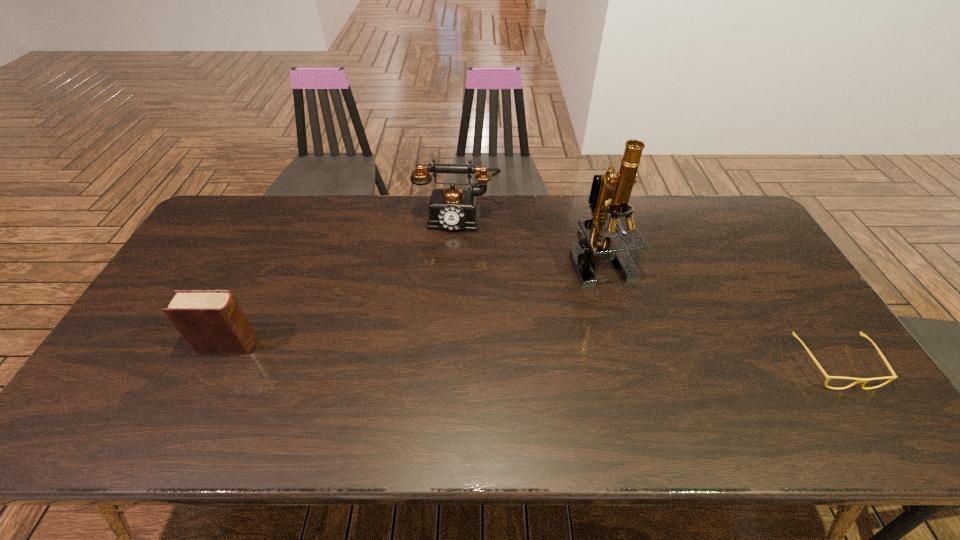
This screenshot has width=960, height=540. I want to click on free region at the far edge of the desktop, so (x=349, y=221).

The width and height of the screenshot is (960, 540). What are the coordinates of `vacant space at the near edge of the desktop` in the screenshot? It's located at (704, 386).

At what (x,y) coordinates should I click in order to perform the action: click on blank space at the right edge of the desktop. Please return your answer as a coordinate pair (x, y). The height and width of the screenshot is (540, 960). Looking at the image, I should click on (766, 250).

You are a GUI agent. You are given a task and a screenshot of the screen. Output one action in this format:
    pyautogui.click(x=<x>, y=<y>)
    Task: Click on the free space at the far left corner
    The width and height of the screenshot is (960, 540).
    Given the screenshot: What is the action you would take?
    pyautogui.click(x=225, y=210)

Where is `vacant area at the far right corner of the desktop`? The image size is (960, 540). vacant area at the far right corner of the desktop is located at coordinates (708, 220).

Where is `free space at the near right corner of the desktop`? The image size is (960, 540). free space at the near right corner of the desktop is located at coordinates (837, 375).

Where is `unoccupied position between the shortest object and the leftmost object`? unoccupied position between the shortest object and the leftmost object is located at coordinates (532, 354).

Where is `free spot between the shortest object and the diary`? free spot between the shortest object and the diary is located at coordinates (532, 354).

Identify the location of vacant area between the spectacles and the leftmost object. Image resolution: width=960 pixels, height=540 pixels. (532, 354).

Where is `free point between the tallest object and the spectacles`? The width and height of the screenshot is (960, 540). free point between the tallest object and the spectacles is located at coordinates (717, 311).